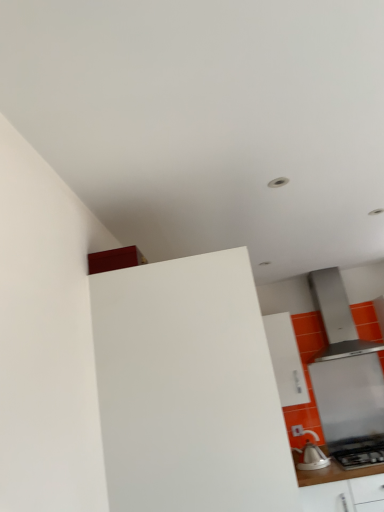
Question: From their relative heights in the image, would you say satin silver range hood at right is taller or shorter than white matte cabinet at center, which is the 1th cabinetry in left-to-right order?

Choices:
 (A) tall
 (B) short

Answer: (B)

Question: From the image's perspective, relative to white matte cabinet at center, the 2th cabinetry from the back, is satin silver range hood at right above or below?

Choices:
 (A) below
 (B) above

Answer: (A)

Question: Estimate the real-world distances between objects in this image. Which object is closer to the satin silver range hood at upper right?

Choices:
 (A) white glossy kettle at lower right
 (B) white glossy counter at lower right
 (C) white matte cabinet at center, the 2th cabinetry from the back
 (D) white glossy cabinet at upper center, the first cabinetry positioned from the right
 (E) satin silver range hood at right

Answer: (E)

Question: Considering the real-world distances, which object is farthest from the white glossy cabinet at upper center, the first cabinetry positioned from the right?

Choices:
 (A) satin silver range hood at upper right
 (B) white glossy kettle at lower right
 (C) satin silver range hood at right
 (D) white matte cabinet at center, which is the 1th cabinetry in left-to-right order
 (E) white glossy counter at lower right

Answer: (D)